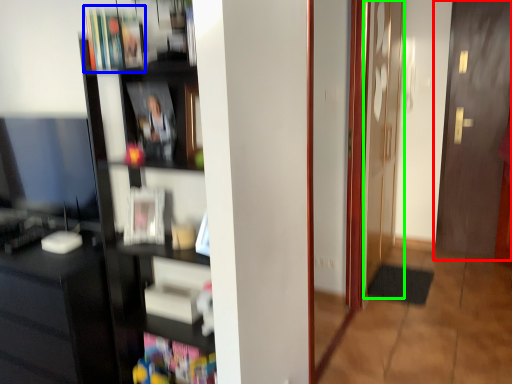
Question: Which object is positioned farthest from door (highlighted by a red box)? Select from book (highlighted by a blue box) and screen door (highlighted by a green box).

Choices:
 (A) book
 (B) screen door

Answer: (A)